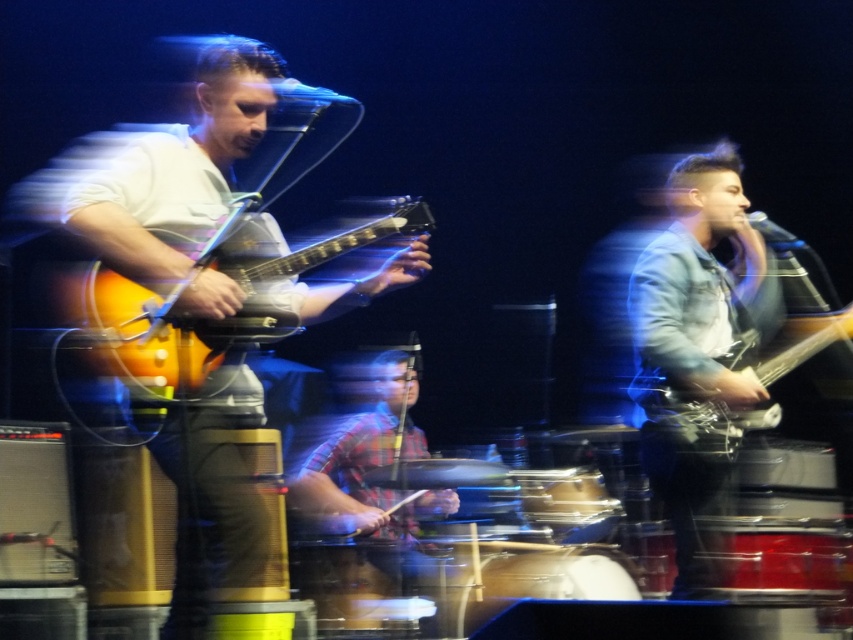
You are a stagehand setting up equipment for a concert. You have to place the matte orange electric guitar at left and the shiny metallic drum at center on a shelf that can only hold items up to 1.2 meters in length. Given their sizes, will both items fit on the shelf?

The matte orange electric guitar at left is larger than the shiny metallic drum at center. If the guitar is over 1.2 meters long, it won t fit. However, since the drum is smaller, it might fit individually. But without exact measurements, we can t be certain. Please check the guitar s length before placing them.

In the live performance scene, there are two musicians visible in the foreground. The first is a guitarist on the left wearing a white shirt and dark pants, and the second is a bassist on the right in a denim jacket over a white shirt. A matte black guitar is located at point (699, 417). Which musician is closer to the point where the matte black guitar is located?

The bassist on the right in a denim jacket over a white shirt is closer to the matte black guitar at point (699, 417) because the guitar is positioned at the right side of the stage.